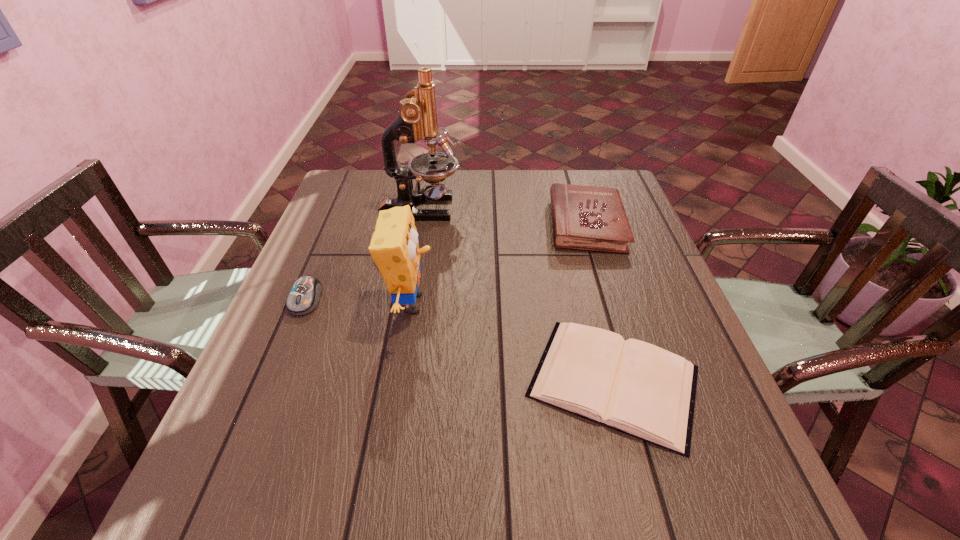
Locate an element on the screen. The image size is (960, 540). free space that is in between the second tallest object and the third shortest object is located at coordinates (498, 264).

Find the location of a particular element. The image size is (960, 540). vacant region between the taller hardback book and the fourth tallest object is located at coordinates (445, 262).

Find the location of a particular element. empty location between the tallest object and the shorter hardback book is located at coordinates (517, 295).

You are a GUI agent. You are given a task and a screenshot of the screen. Output one action in this format:
    pyautogui.click(x=<x>, y=<y>)
    Task: Click on the vacant area that lies between the third shortest object and the shorter hardback book
    This screenshot has height=540, width=960.
    Given the screenshot: What is the action you would take?
    pyautogui.click(x=600, y=303)

The image size is (960, 540). I want to click on free space between the tallest object and the second shortest object, so tap(363, 254).

You are a GUI agent. You are given a task and a screenshot of the screen. Output one action in this format:
    pyautogui.click(x=<x>, y=<y>)
    Task: Click on the object that is the fourth closest to the microscope
    This screenshot has height=540, width=960.
    Given the screenshot: What is the action you would take?
    pyautogui.click(x=637, y=388)

Where is `the second closest object relative to the second tallest object`? the second closest object relative to the second tallest object is located at coordinates (417, 118).

Where is `free spot that satisfies the following two spatial constraints: 1. on the face of the shorter hardback book; 2. on the left side of the fourth shortest object`? The image size is (960, 540). free spot that satisfies the following two spatial constraints: 1. on the face of the shorter hardback book; 2. on the left side of the fourth shortest object is located at coordinates (399, 381).

Find the location of a particular element. The width and height of the screenshot is (960, 540). free space in the image that satisfies the following two spatial constraints: 1. at the eyepiece of the microscope; 2. on the back side of the shortest object is located at coordinates (389, 381).

The height and width of the screenshot is (540, 960). I want to click on free spot that satisfies the following two spatial constraints: 1. on the back side of the shorter hardback book; 2. on the left side of the taller hardback book, so click(x=572, y=225).